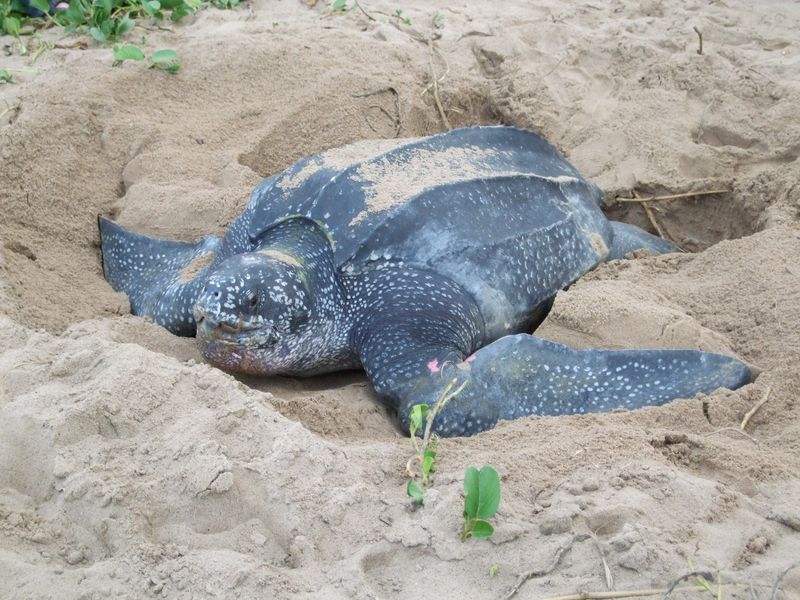
At what (x,y) coordinates should I click in order to perform the action: click on the right front leg. Please return your answer as a coordinate pair (x, y). Image resolution: width=800 pixels, height=600 pixels. Looking at the image, I should click on (142, 270).